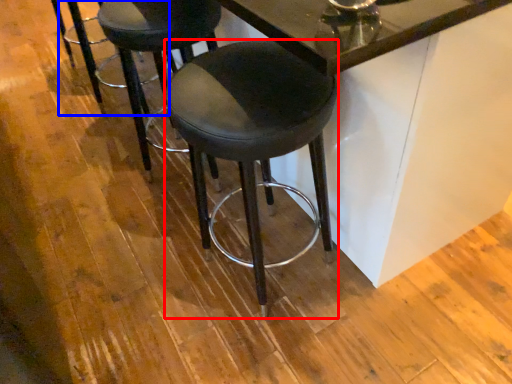
Question: Which of the following is the farthest to the observer, stool (highlighted by a red box) or bar stool (highlighted by a blue box)?

Choices:
 (A) stool
 (B) bar stool

Answer: (B)